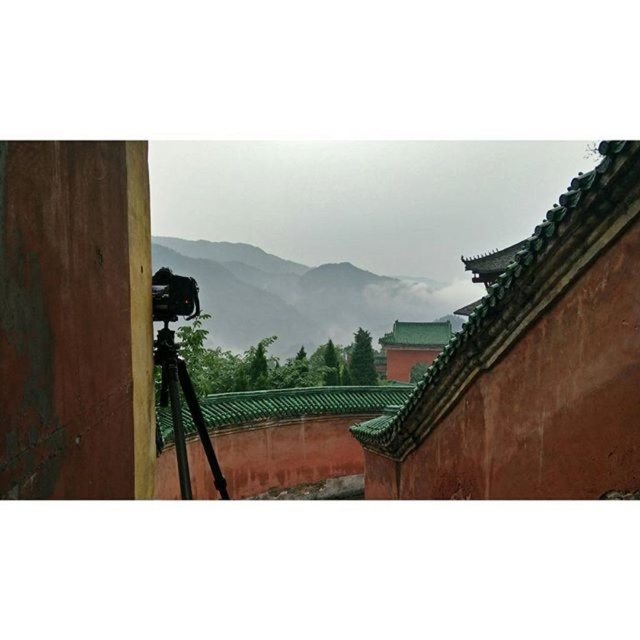
Based on the photo, you are setting up equipment for a photography session. You have a green metallic tripod at center and a black plastic camera at lower left. Which equipment is narrower in width?

The green metallic tripod at center has a lesser width compared to the black plastic camera at lower left, so the tripod is narrower.

You are a photographer standing in front of the scene. You want to capture a photo that includes both the green matte mountain at center and the black plastic camera at lower left. Given their sizes, which object will occupy more space in the photo?

The green matte mountain at center will occupy more space in the photo because its width is larger than the black plastic camera at lower left.